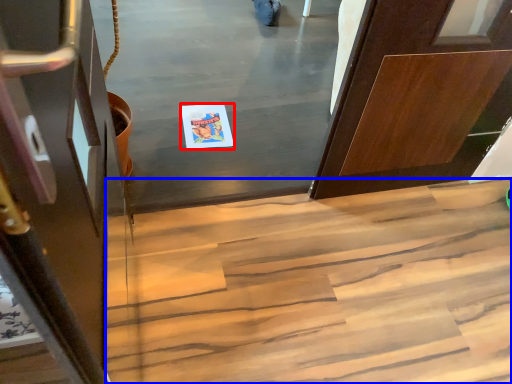
Question: Which point is closer to the camera, postcard (highlighted by a red box) or stairs (highlighted by a blue box)?

Choices:
 (A) postcard
 (B) stairs

Answer: (B)